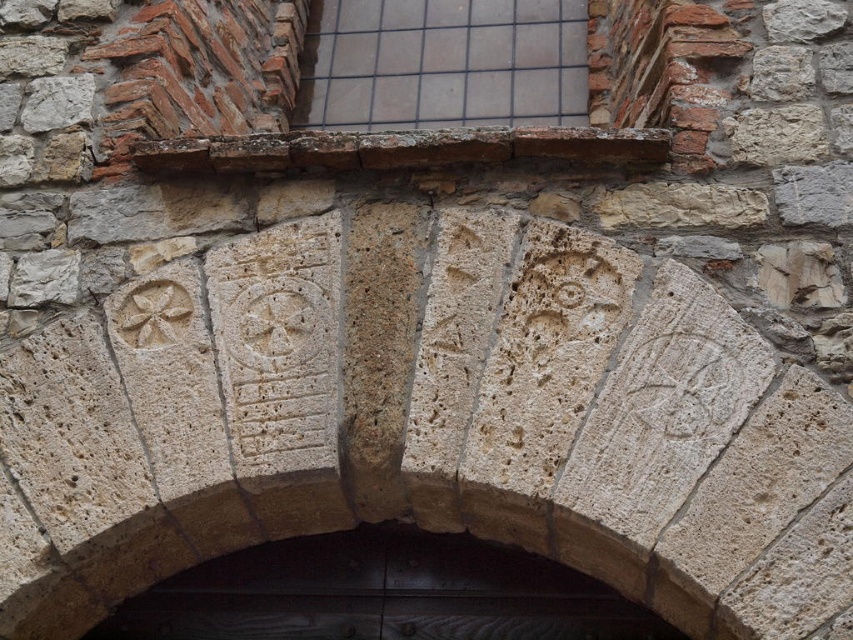
Question: Can you confirm if dark wood door at center is positioned to the right of clear glass window at upper center?

Choices:
 (A) no
 (B) yes

Answer: (A)

Question: Can you confirm if dark wood door at center is positioned to the left of clear glass window at upper center?

Choices:
 (A) yes
 (B) no

Answer: (A)

Question: Which point appears closest to the camera in this image?

Choices:
 (A) (558, 97)
 (B) (300, 596)

Answer: (B)

Question: Is the position of dark wood door at center less distant than that of clear glass window at upper center?

Choices:
 (A) no
 (B) yes

Answer: (B)

Question: Which object appears closest to the camera in this image?

Choices:
 (A) clear glass window at upper center
 (B) dark wood door at center

Answer: (B)